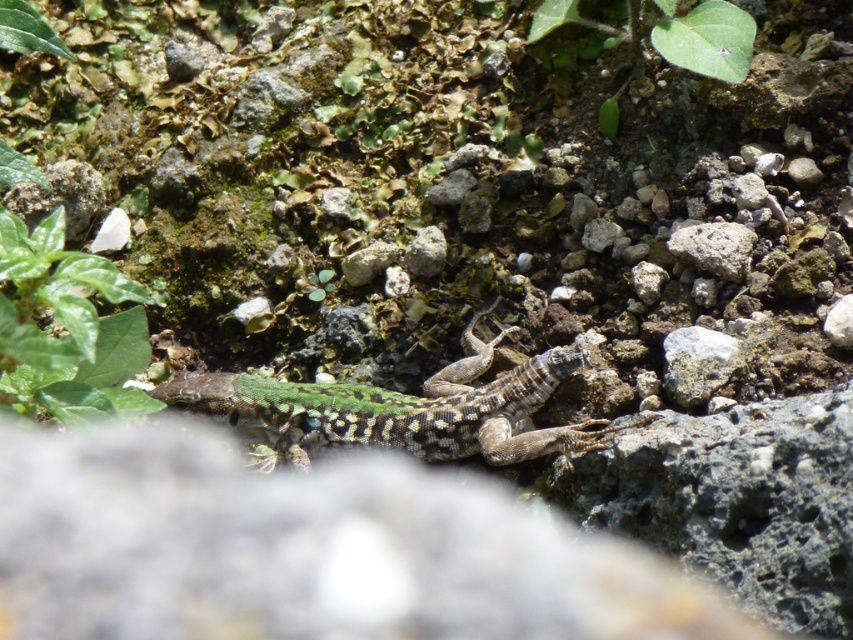
Does speckled green lizard at center have a larger size compared to green leafy plant at left?

Yes.

Is speckled green lizard at center above green leafy plant at left?

No.

Find the location of a particular element. This screenshot has height=640, width=853. speckled green lizard at center is located at coordinates (401, 408).

Is speckled green lizard at center to the left of green leafy plant at upper center from the viewer's perspective?

Correct, you'll find speckled green lizard at center to the left of green leafy plant at upper center.

Is speckled green lizard at center taller than green leafy plant at upper center?

Yes, speckled green lizard at center is taller than green leafy plant at upper center.

Is point (496, 438) in front of point (735, 12)?

Yes, point (496, 438) is closer to viewer.

In order to click on speckled green lizard at center in this screenshot , I will do `click(401, 408)`.

Is green leafy plant at left below green leafy plant at upper center?

Correct, green leafy plant at left is located below green leafy plant at upper center.

Image resolution: width=853 pixels, height=640 pixels. Identify the location of green leafy plant at left. (67, 326).

Identify the location of green leafy plant at left. This screenshot has height=640, width=853. (67, 326).

You are a GUI agent. You are given a task and a screenshot of the screen. Output one action in this format:
    pyautogui.click(x=<x>, y=<y>)
    Task: Click on the green leafy plant at left
    The height and width of the screenshot is (640, 853).
    Given the screenshot: What is the action you would take?
    pyautogui.click(x=67, y=326)